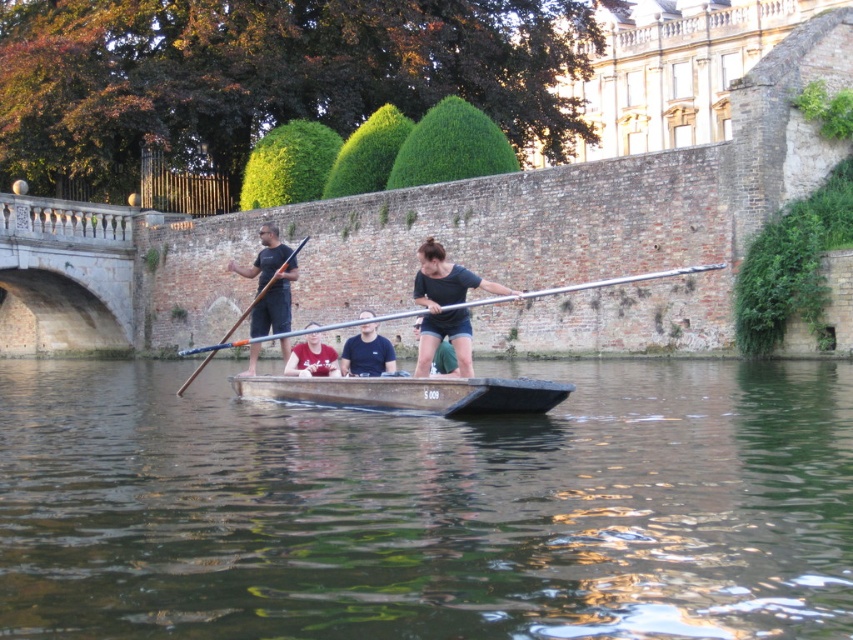
Is brown wooden boat at center smaller than wooden canoe at center?

Incorrect, brown wooden boat at center is not smaller in size than wooden canoe at center.

At what (x,y) coordinates should I click in order to perform the action: click on brown wooden boat at center. Please return your answer as a coordinate pair (x, y). Looking at the image, I should click on (428, 508).

Identify the location of brown wooden boat at center. 428,508.

Is brown wooden boat at center to the right of dark brown shorts at center from the viewer's perspective?

Indeed, brown wooden boat at center is positioned on the right side of dark brown shorts at center.

How much distance is there between brown wooden boat at center and dark brown shorts at center?

brown wooden boat at center is 13.16 meters from dark brown shorts at center.

Measure the distance between brown wooden boat at center and camera.

The distance of brown wooden boat at center from camera is 17.81 meters.

Where is `brown wooden boat at center`? This screenshot has width=853, height=640. brown wooden boat at center is located at coordinates (428, 508).

Can you confirm if brown wooden boat at center is shorter than matte red shirt at center?

Incorrect, brown wooden boat at center's height does not fall short of matte red shirt at center's.

How far apart are brown wooden boat at center and matte red shirt at center?

The distance of brown wooden boat at center from matte red shirt at center is 12.54 meters.

Who is more forward, (416,486) or (334,353)?

Positioned in front is point (416,486).

In order to click on brown wooden boat at center in this screenshot , I will do `click(428, 508)`.